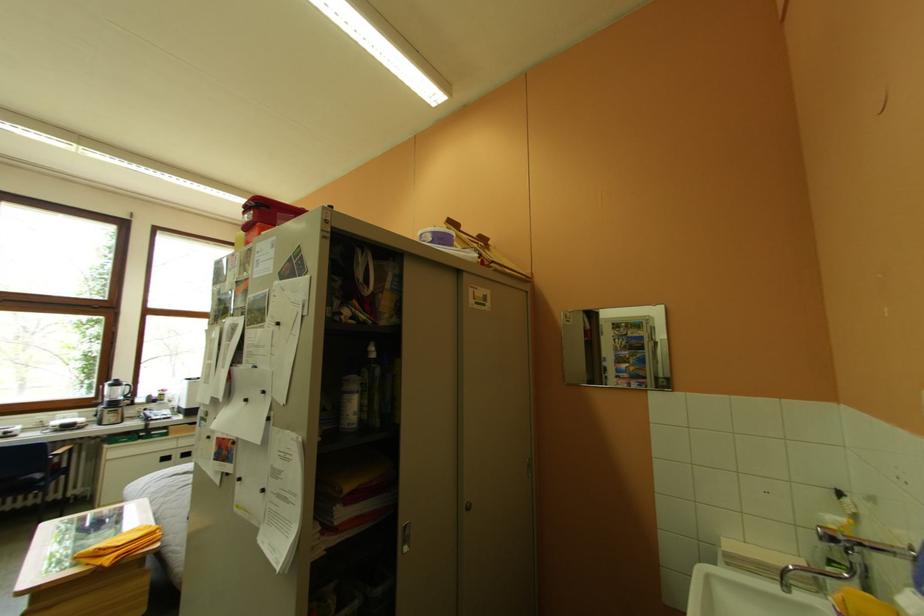
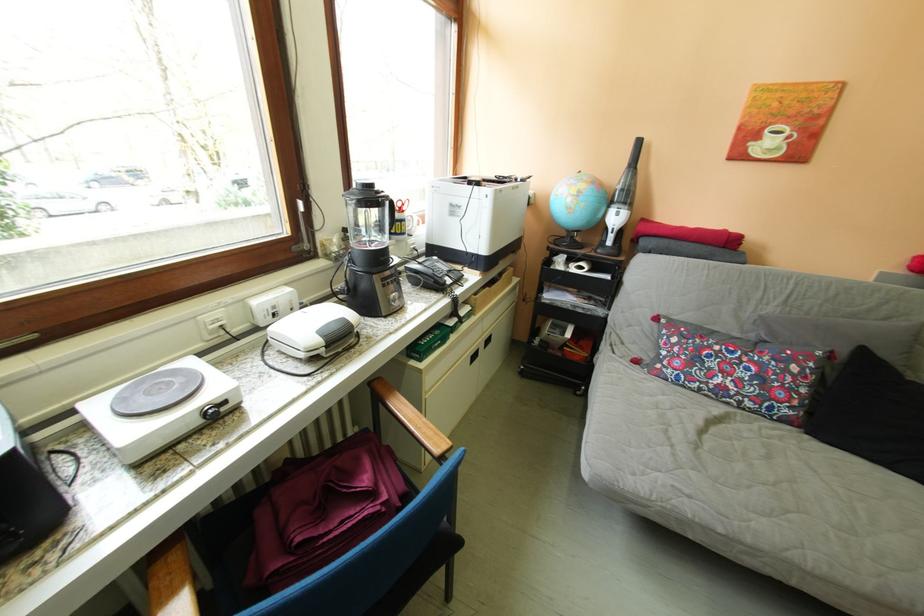
The point at (177, 482) is marked in the first image. Where is the corresponding point in the second image?

(713, 455)